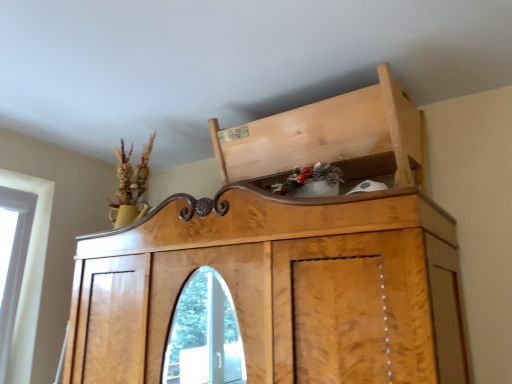
What do you see at coordinates (329, 135) in the screenshot? I see `natural wood cabinet at upper center` at bounding box center [329, 135].

You are a GUI agent. You are given a task and a screenshot of the screen. Output one action in this format:
    pyautogui.click(x=<x>, y=<y>)
    Task: Click on the natural wood cabinet at upper center
    The width and height of the screenshot is (512, 384).
    Given the screenshot: What is the action you would take?
    coord(329,135)

This screenshot has width=512, height=384. Describe the element at coordinates (288, 259) in the screenshot. I see `wooden cabinet at upper center` at that location.

What is the approximate height of wooden cabinet at upper center?

38.20 inches.

Measure the distance between point (277, 208) and camera.

Point (277, 208) and camera are 1.60 meters apart.

You are a GUI agent. You are given a task and a screenshot of the screen. Output one action in this format:
    pyautogui.click(x=<x>, y=<y>)
    Task: Click on the wooden cabinet at upper center
    The height and width of the screenshot is (384, 512).
    Given the screenshot: What is the action you would take?
    tap(288, 259)

Locate an element on the screen. natural wood cabinet at upper center is located at coordinates (329, 135).

In the image, is wooden cabinet at upper center on the left side or the right side of natural wood cabinet at upper center?

Clearly, wooden cabinet at upper center is on the left of natural wood cabinet at upper center in the image.

Considering the positions of objects wooden cabinet at upper center and natural wood cabinet at upper center in the image provided, who is in front, wooden cabinet at upper center or natural wood cabinet at upper center?

wooden cabinet at upper center is in front.

Which point is more distant from viewer, (262, 192) or (335, 122)?

The point (335, 122) is more distant.

From the image's perspective, is wooden cabinet at upper center located above or below natural wood cabinet at upper center?

Clearly, from the image's perspective, wooden cabinet at upper center is below natural wood cabinet at upper center.

From a real-world perspective, between wooden cabinet at upper center and natural wood cabinet at upper center, who is vertically higher?

natural wood cabinet at upper center is physically above.

From the picture: Is wooden cabinet at upper center wider than natural wood cabinet at upper center?

Indeed, wooden cabinet at upper center has a greater width compared to natural wood cabinet at upper center.

In terms of height, does wooden cabinet at upper center look taller or shorter compared to natural wood cabinet at upper center?

wooden cabinet at upper center is taller than natural wood cabinet at upper center.

Can you confirm if wooden cabinet at upper center is bigger than natural wood cabinet at upper center?

Yes.

Would you say wooden cabinet at upper center is outside natural wood cabinet at upper center?

Yes, wooden cabinet at upper center is outside of natural wood cabinet at upper center.

Are wooden cabinet at upper center and natural wood cabinet at upper center making contact?

There is a gap between wooden cabinet at upper center and natural wood cabinet at upper center.

Is wooden cabinet at upper center aimed at natural wood cabinet at upper center?

No, wooden cabinet at upper center is not oriented towards natural wood cabinet at upper center.

In the image, there is a natural wood cabinet at upper center. Where is `furniture below it (from a real-world perspective)`? This screenshot has width=512, height=384. furniture below it (from a real-world perspective) is located at coordinates (288, 259).

Considering the relative positions of natural wood cabinet at upper center and wooden cabinet at upper center in the image provided, is natural wood cabinet at upper center to the right of wooden cabinet at upper center from the viewer's perspective?

Indeed, natural wood cabinet at upper center is positioned on the right side of wooden cabinet at upper center.

Does natural wood cabinet at upper center lie in front of wooden cabinet at upper center?

No.

Which is in front, point (347, 102) or point (373, 146)?

Positioned in front is point (347, 102).

From the image's perspective, which is above, natural wood cabinet at upper center or wooden cabinet at upper center?

natural wood cabinet at upper center is shown above in the image.

From a real-world perspective, is natural wood cabinet at upper center on top of wooden cabinet at upper center?

Yes, from a real-world perspective, natural wood cabinet at upper center is over wooden cabinet at upper center

Can you confirm if natural wood cabinet at upper center is thinner than wooden cabinet at upper center?

Yes, natural wood cabinet at upper center is thinner than wooden cabinet at upper center.

Which of these two, natural wood cabinet at upper center or wooden cabinet at upper center, stands shorter?

With less height is natural wood cabinet at upper center.

Does natural wood cabinet at upper center have a larger size compared to wooden cabinet at upper center?

No, natural wood cabinet at upper center is not bigger than wooden cabinet at upper center.

Can we say natural wood cabinet at upper center lies outside wooden cabinet at upper center?

Yes, natural wood cabinet at upper center is located beyond the bounds of wooden cabinet at upper center.

Based on the photo, is natural wood cabinet at upper center positioned far away from wooden cabinet at upper center?

No, there isn't a large distance between natural wood cabinet at upper center and wooden cabinet at upper center.

Is wooden cabinet at upper center at the back of natural wood cabinet at upper center?

natural wood cabinet at upper center is not turned away from wooden cabinet at upper center.

What's the angular difference between natural wood cabinet at upper center and wooden cabinet at upper center's facing directions?

There is a 2.44-degree angle between the facing directions of natural wood cabinet at upper center and wooden cabinet at upper center.

Image resolution: width=512 pixels, height=384 pixels. Identify the location of cabinetry that is on the right side of wooden cabinet at upper center. (329, 135).

Identify the location of cabinetry lying above the wooden cabinet at upper center (from the image's perspective). The width and height of the screenshot is (512, 384). (329, 135).

Where is `furniture that is on the left side of natural wood cabinet at upper center`? The image size is (512, 384). furniture that is on the left side of natural wood cabinet at upper center is located at coordinates (288, 259).